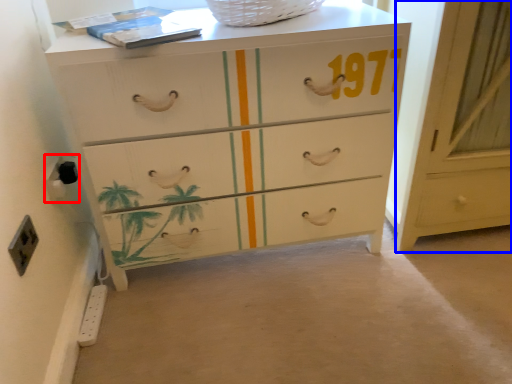
Question: Among these objects, which one is nearest to the camera, electric outlet (highlighted by a red box) or cabinetry (highlighted by a blue box)?

Choices:
 (A) electric outlet
 (B) cabinetry

Answer: (B)